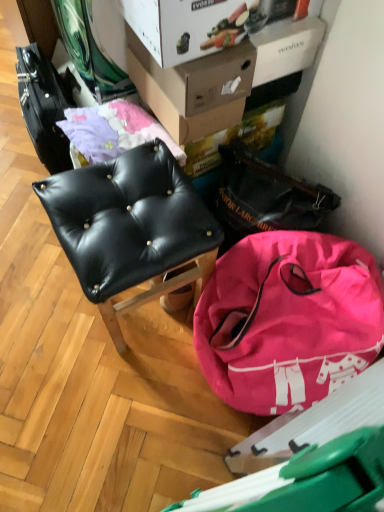
Question: Is point click(208, 98) closer or farther from the camera than point click(188, 31)?

Choices:
 (A) closer
 (B) farther

Answer: (B)

Question: From a real-world perspective, is cardboard box at upper center, which ranks as the 2th cardboard box in front-to-back order, above or below white cardboard box at upper center, the second cardboard box when ordered from back to front?

Choices:
 (A) above
 (B) below

Answer: (B)

Question: Estimate the real-world distances between objects in this image. Which object is closer to the cardboard box at upper center, arranged as the 1th cardboard box when viewed from the back?

Choices:
 (A) pink fabric bag at lower right
 (B) black leather chair at center
 (C) white cardboard box at upper center, which is counted as the 1th cardboard box, starting from the front
 (D) black leather messenger bag at upper right

Answer: (C)

Question: Estimate the real-world distances between objects in this image. Which object is closer to the black leather messenger bag at upper right?

Choices:
 (A) cardboard box at upper center, which ranks as the 2th cardboard box in front-to-back order
 (B) black leather chair at center
 (C) pink fabric bag at lower right
 (D) white cardboard box at upper center, which is counted as the 1th cardboard box, starting from the front

Answer: (C)